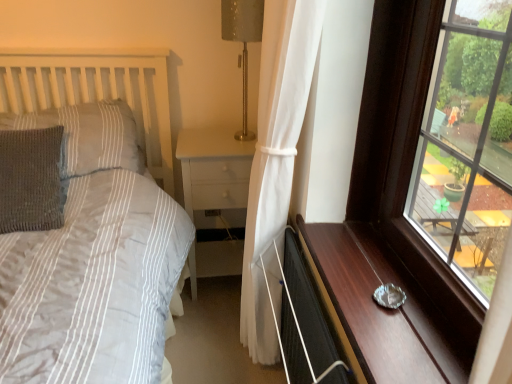
Question: Can you confirm if knitted gray pillow at left, which is the second pillow from bottom to top, is taller than metallic silver ashtray at right?

Choices:
 (A) no
 (B) yes

Answer: (B)

Question: Is knitted gray pillow at left, which is the second pillow from bottom to top, outside of metallic silver ashtray at right?

Choices:
 (A) no
 (B) yes

Answer: (B)

Question: From a real-world perspective, is knitted gray pillow at left, which is the second pillow from bottom to top, positioned over metallic silver ashtray at right based on gravity?

Choices:
 (A) yes
 (B) no

Answer: (A)

Question: From the image's perspective, is knitted gray pillow at left, which is the second pillow from bottom to top, below metallic silver ashtray at right?

Choices:
 (A) no
 (B) yes

Answer: (A)

Question: Is metallic silver ashtray at right a part of knitted gray pillow at left, which is the second pillow from bottom to top?

Choices:
 (A) no
 (B) yes

Answer: (A)

Question: Is gray knitted pillow at left, which is counted as the 1th pillow, starting from the bottom, wider or thinner than metallic silver ashtray at right?

Choices:
 (A) thin
 (B) wide

Answer: (B)

Question: Is point (17, 180) closer or farther from the camera than point (362, 337)?

Choices:
 (A) closer
 (B) farther

Answer: (B)

Question: Based on their positions, is gray knitted pillow at left, which is counted as the 1th pillow, starting from the bottom, located to the left or right of metallic silver ashtray at right?

Choices:
 (A) right
 (B) left

Answer: (B)

Question: Is gray knitted pillow at left, the 2th pillow from the top, in front of or behind metallic silver ashtray at right in the image?

Choices:
 (A) front
 (B) behind

Answer: (B)

Question: Is black matte screen door at lower right wider or thinner than transparent glass window at right?

Choices:
 (A) thin
 (B) wide

Answer: (A)

Question: Is black matte screen door at lower right in front of or behind transparent glass window at right in the image?

Choices:
 (A) behind
 (B) front

Answer: (A)

Question: Is black matte screen door at lower right inside the boundaries of transparent glass window at right, or outside?

Choices:
 (A) inside
 (B) outside

Answer: (B)

Question: From the image's perspective, relative to transparent glass window at right, is black matte screen door at lower right above or below?

Choices:
 (A) below
 (B) above

Answer: (A)

Question: In terms of size, does metallic silver ashtray at right appear bigger or smaller than transparent glass window at right?

Choices:
 (A) small
 (B) big

Answer: (A)

Question: From a real-world perspective, is metallic silver ashtray at right above or below transparent glass window at right?

Choices:
 (A) below
 (B) above

Answer: (A)